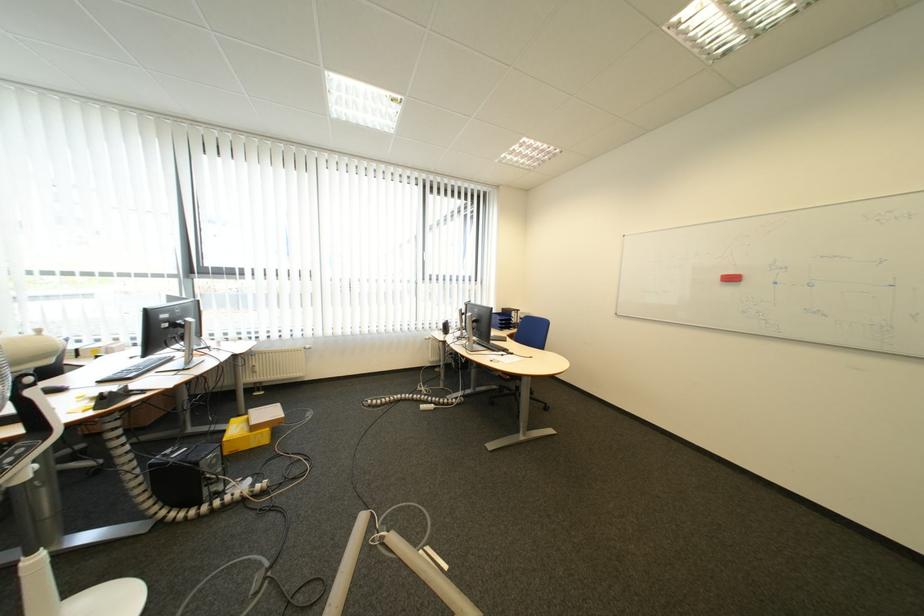
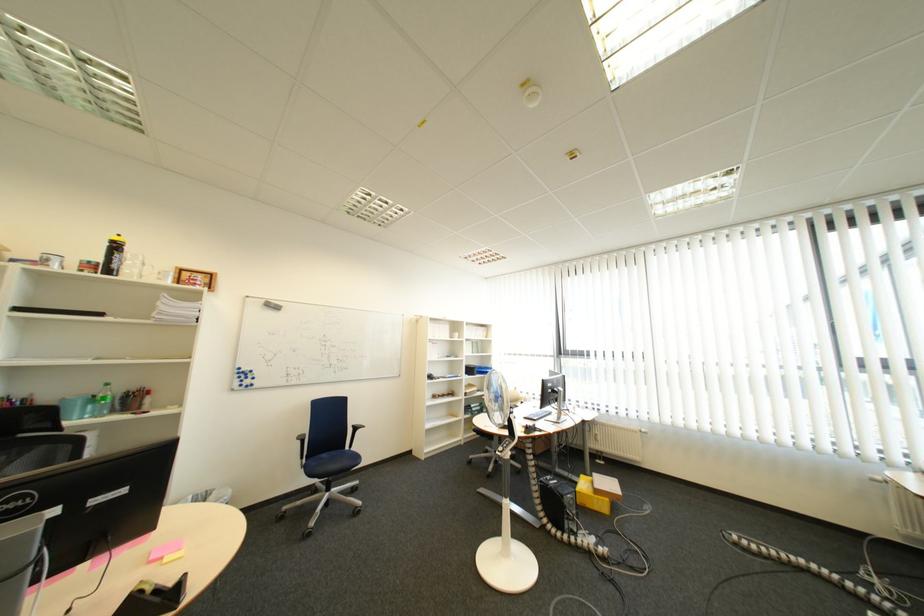
In the second image, find the point that corresponds to pixel 185 387 in the first image.

(565, 434)